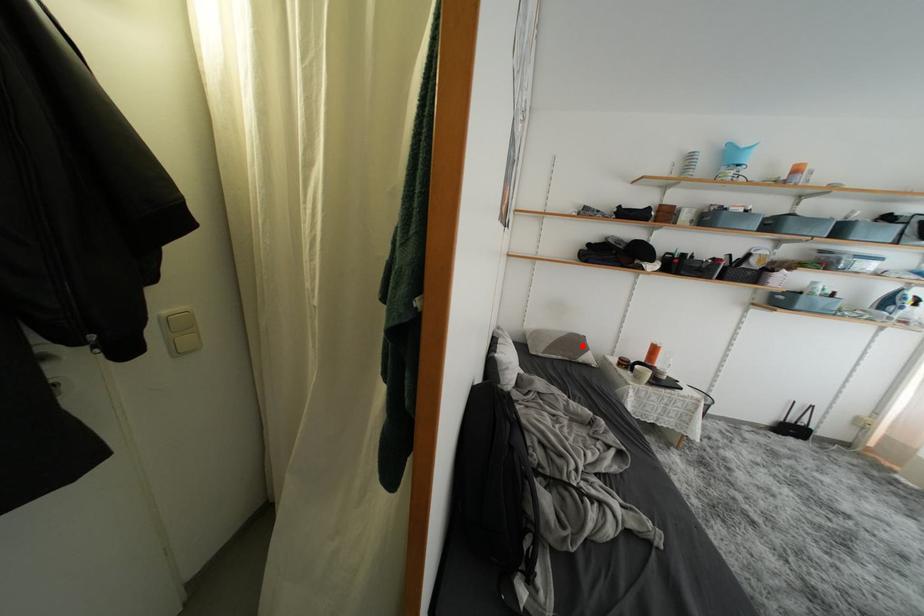
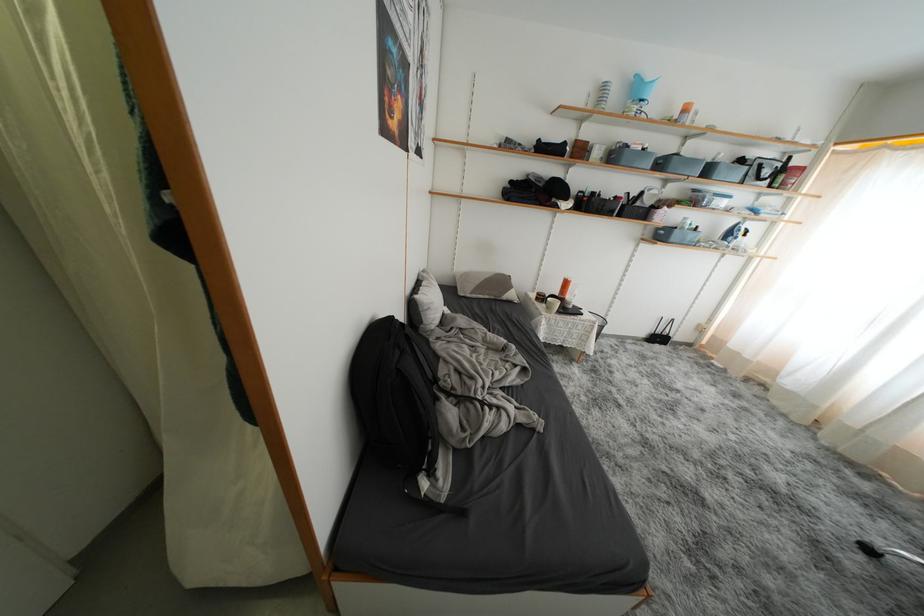
Find the pixel in the second image that matches the highlighted location in the first image.

(508, 286)